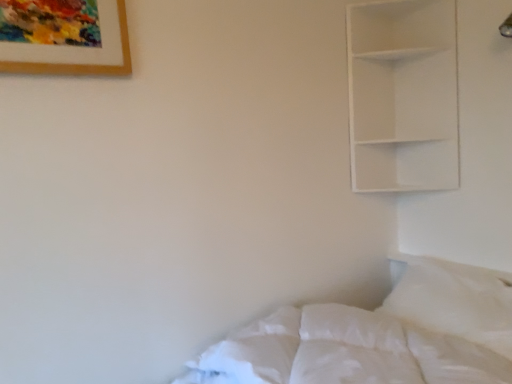
Question: Does wooden framed artwork at upper left touch white soft pillow at lower right?

Choices:
 (A) yes
 (B) no

Answer: (B)

Question: Does wooden framed artwork at upper left have a greater width compared to white soft pillow at lower right?

Choices:
 (A) no
 (B) yes

Answer: (A)

Question: Is wooden framed artwork at upper left thinner than white soft pillow at lower right?

Choices:
 (A) yes
 (B) no

Answer: (A)

Question: Considering the relative sizes of wooden framed artwork at upper left and white soft pillow at lower right in the image provided, is wooden framed artwork at upper left taller than white soft pillow at lower right?

Choices:
 (A) yes
 (B) no

Answer: (B)

Question: Can you confirm if wooden framed artwork at upper left is positioned to the right of white soft pillow at lower right?

Choices:
 (A) yes
 (B) no

Answer: (B)

Question: From a real-world perspective, is white soft bed at lower right physically located above or below wooden framed artwork at upper left?

Choices:
 (A) below
 (B) above

Answer: (A)

Question: Is white soft bed at lower right in front of or behind wooden framed artwork at upper left in the image?

Choices:
 (A) behind
 (B) front

Answer: (B)

Question: From the image's perspective, is white soft bed at lower right positioned above or below wooden framed artwork at upper left?

Choices:
 (A) above
 (B) below

Answer: (B)

Question: Considering the positions of white soft bed at lower right and wooden framed artwork at upper left in the image, is white soft bed at lower right wider or thinner than wooden framed artwork at upper left?

Choices:
 (A) thin
 (B) wide

Answer: (B)

Question: Is white soft bed at lower right bigger or smaller than white soft pillow at lower right?

Choices:
 (A) big
 (B) small

Answer: (A)

Question: In the image, is white soft bed at lower right on the left side or the right side of white soft pillow at lower right?

Choices:
 (A) left
 (B) right

Answer: (A)

Question: Is white soft bed at lower right wider or thinner than white soft pillow at lower right?

Choices:
 (A) wide
 (B) thin

Answer: (A)

Question: Relative to white soft pillow at lower right, is white soft bed at lower right in front or behind?

Choices:
 (A) front
 (B) behind

Answer: (A)

Question: Is white soft pillow at lower right bigger or smaller than white soft bed at lower right?

Choices:
 (A) big
 (B) small

Answer: (B)

Question: Choose the correct answer: Is white soft pillow at lower right inside white soft bed at lower right or outside it?

Choices:
 (A) outside
 (B) inside

Answer: (A)